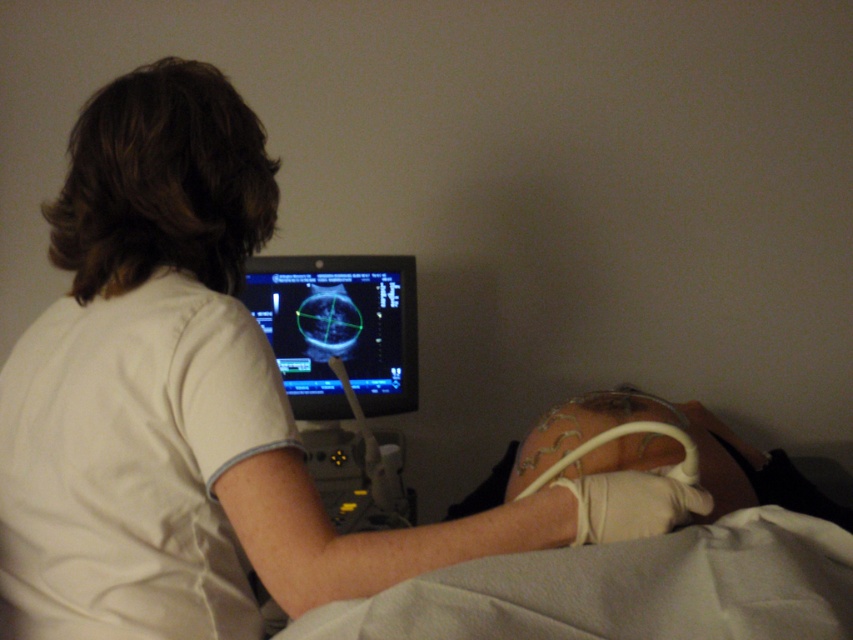
Is white fabric bed at lower center thinner than black glossy monitor at center?

No, white fabric bed at lower center is not thinner than black glossy monitor at center.

Who is positioned more to the left, white fabric bed at lower center or black glossy monitor at center?

Positioned to the left is black glossy monitor at center.

At what (x,y) coordinates should I click in order to perform the action: click on white fabric bed at lower center. Please return your answer as a coordinate pair (x, y). Looking at the image, I should click on (625, 589).